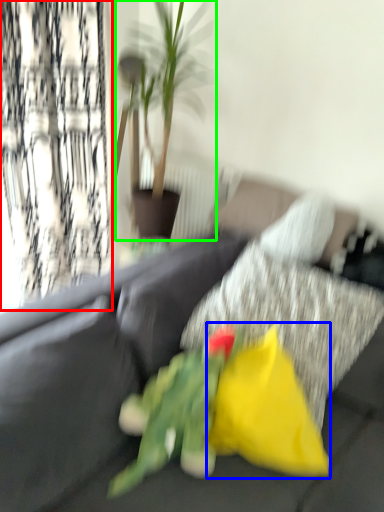
Question: Which object is the closest to the curtain (highlighted by a red box)? Choose among these: flower (highlighted by a blue box) or houseplant (highlighted by a green box).

Choices:
 (A) flower
 (B) houseplant

Answer: (B)